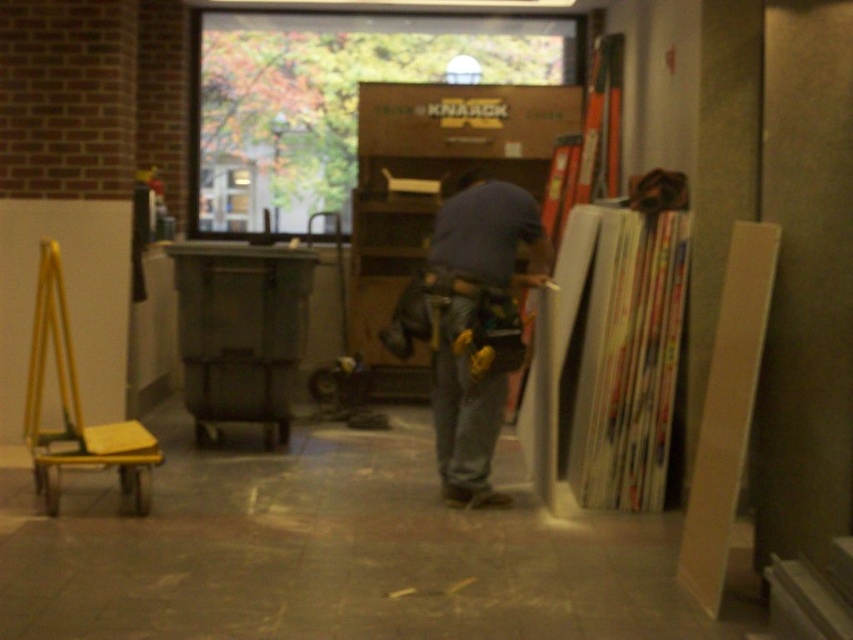
Question: Which object appears closest to the camera in this image?

Choices:
 (A) brown cardboard bookshelf at center
 (B) denim at center
 (C) blue denim jeans at center

Answer: (B)

Question: Can you confirm if brown cardboard bookshelf at center is positioned below blue denim jeans at center?

Choices:
 (A) no
 (B) yes

Answer: (A)

Question: Can you confirm if brown cardboard bookshelf at center is thinner than blue denim jeans at center?

Choices:
 (A) yes
 (B) no

Answer: (B)

Question: Does blue denim jeans at center appear on the right side of denim at center?

Choices:
 (A) no
 (B) yes

Answer: (B)

Question: Which object is farther from the camera taking this photo?

Choices:
 (A) denim at center
 (B) blue denim jeans at center

Answer: (B)

Question: Which object appears farthest from the camera in this image?

Choices:
 (A) brown cardboard bookshelf at center
 (B) denim at center
 (C) blue denim jeans at center

Answer: (A)